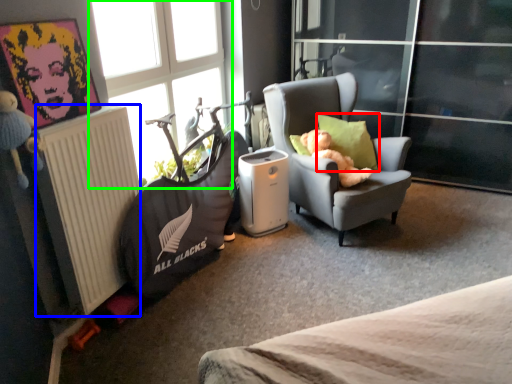
Question: Which object is the farthest from pillow (highlighted by a red box)? Choose among these: radiator (highlighted by a blue box) or window (highlighted by a green box).

Choices:
 (A) radiator
 (B) window

Answer: (A)